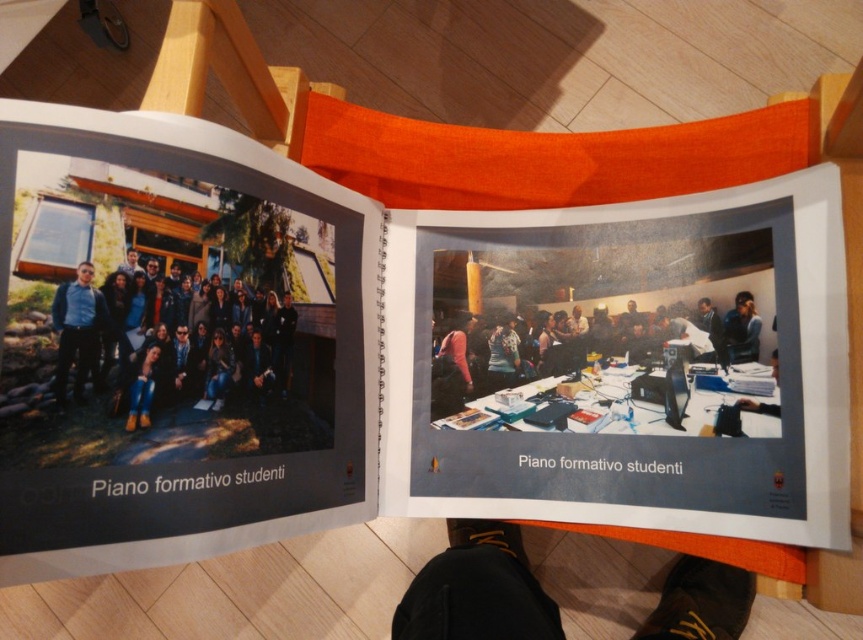
Is black leather shoes at lower center closer to camera compared to matte blue shirt at center?

No, black leather shoes at lower center is further to the viewer.

Is black leather shoes at lower center positioned behind matte blue shirt at center?

Yes, it is.

Is point (421, 628) farther from viewer compared to point (79, 278)?

Yes, it is.

Locate an element on the screen. This screenshot has height=640, width=863. black leather shoes at lower center is located at coordinates (477, 589).

Between point (82, 276) and point (753, 307), which one is positioned behind?

The point (753, 307) is behind.

Does point (80, 292) lie behind point (758, 342)?

No, it is in front of (758, 342).

Identify the location of matte blue shirt at center. (77, 330).

Is black leather shoes at lower center to the left of blue fabric shirt at center from the viewer's perspective?

Indeed, black leather shoes at lower center is positioned on the left side of blue fabric shirt at center.

Who is shorter, black leather shoes at lower center or blue fabric shirt at center?

blue fabric shirt at center

Is point (435, 632) in front of point (747, 317)?

That is True.

You are a GUI agent. You are given a task and a screenshot of the screen. Output one action in this format:
    pyautogui.click(x=<x>, y=<y>)
    Task: Click on the black leather shoes at lower center
    
    Given the screenshot: What is the action you would take?
    pyautogui.click(x=477, y=589)